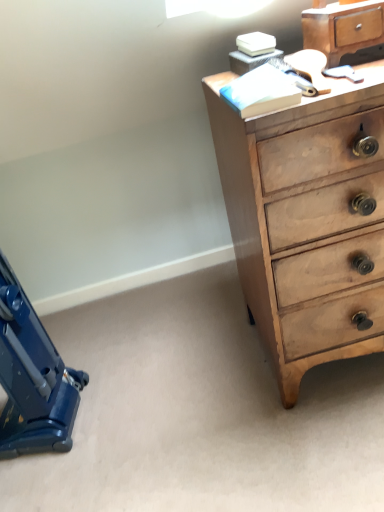
Image resolution: width=384 pixels, height=512 pixels. I want to click on wooden chest of drawers at upper right, so click(x=343, y=28).

What do you see at coordinates (343, 28) in the screenshot? I see `wooden chest of drawers at upper right` at bounding box center [343, 28].

The width and height of the screenshot is (384, 512). In order to click on blue plastic vacuum cleaner at lower left in this screenshot , I will do `click(32, 378)`.

Between light brown wood chest of drawers at upper right and blue plastic vacuum cleaner at lower left, which one has larger width?

Wider between the two is light brown wood chest of drawers at upper right.

From a real-world perspective, between light brown wood chest of drawers at upper right and blue plastic vacuum cleaner at lower left, who is vertically lower?

blue plastic vacuum cleaner at lower left is physically lower.

Considering the sizes of objects light brown wood chest of drawers at upper right and blue plastic vacuum cleaner at lower left in the image provided, who is bigger, light brown wood chest of drawers at upper right or blue plastic vacuum cleaner at lower left?

Bigger between the two is light brown wood chest of drawers at upper right.

In the scene shown: Is light brown wood chest of drawers at upper right further to the viewer compared to blue plastic vacuum cleaner at lower left?

No.

From a real-world perspective, is wooden chest of drawers at upper right positioned over light brown wood chest of drawers at upper right based on gravity?

Yes, from a real-world perspective, wooden chest of drawers at upper right is above light brown wood chest of drawers at upper right.

Is wooden chest of drawers at upper right positioned with its back to light brown wood chest of drawers at upper right?

wooden chest of drawers at upper right is not turned away from light brown wood chest of drawers at upper right.

Based on the photo, how many degrees apart are the facing directions of wooden chest of drawers at upper right and light brown wood chest of drawers at upper right?

The angle between the facing direction of wooden chest of drawers at upper right and the facing direction of light brown wood chest of drawers at upper right is 0.258 degrees.

Which of these two, wooden chest of drawers at upper right or light brown wood chest of drawers at upper right, is wider?

light brown wood chest of drawers at upper right is wider.

Does point (19, 289) appear closer or farther from the camera than point (349, 355)?

Point (19, 289).

From the image's perspective, between blue plastic vacuum cleaner at lower left and light brown wood chest of drawers at upper right, who is located below?

Result: blue plastic vacuum cleaner at lower left.

In terms of size, does blue plastic vacuum cleaner at lower left appear bigger or smaller than light brown wood chest of drawers at upper right?

blue plastic vacuum cleaner at lower left is smaller than light brown wood chest of drawers at upper right.

Consider the image. Considering their positions, is blue plastic vacuum cleaner at lower left located in front of or behind light brown wood chest of drawers at upper right?

Clearly, blue plastic vacuum cleaner at lower left is behind light brown wood chest of drawers at upper right.

Considering the sizes of objects wooden chest of drawers at upper right and blue plastic vacuum cleaner at lower left in the image provided, who is wider, wooden chest of drawers at upper right or blue plastic vacuum cleaner at lower left?

blue plastic vacuum cleaner at lower left is wider.

Considering the positions of objects wooden chest of drawers at upper right and blue plastic vacuum cleaner at lower left in the image provided, who is more to the left, wooden chest of drawers at upper right or blue plastic vacuum cleaner at lower left?

blue plastic vacuum cleaner at lower left is more to the left.

Is wooden chest of drawers at upper right outside of blue plastic vacuum cleaner at lower left?

wooden chest of drawers at upper right is positioned outside blue plastic vacuum cleaner at lower left.

Can you confirm if wooden chest of drawers at upper right is bigger than blue plastic vacuum cleaner at lower left?

Incorrect, wooden chest of drawers at upper right is not larger than blue plastic vacuum cleaner at lower left.

Can you confirm if blue plastic vacuum cleaner at lower left is smaller than wooden chest of drawers at upper right?

Incorrect, blue plastic vacuum cleaner at lower left is not smaller in size than wooden chest of drawers at upper right.

How many degrees apart are the facing directions of blue plastic vacuum cleaner at lower left and wooden chest of drawers at upper right?

The angular difference between blue plastic vacuum cleaner at lower left and wooden chest of drawers at upper right is 82.6 degrees.

Does blue plastic vacuum cleaner at lower left have a lesser height compared to wooden chest of drawers at upper right?

Incorrect, the height of blue plastic vacuum cleaner at lower left does not fall short of that of wooden chest of drawers at upper right.

Is blue plastic vacuum cleaner at lower left not close to wooden chest of drawers at upper right?

Yes.

Looking at their sizes, would you say light brown wood chest of drawers at upper right is wider or thinner than wooden chest of drawers at upper right?

Considering their sizes, light brown wood chest of drawers at upper right looks broader than wooden chest of drawers at upper right.

Is light brown wood chest of drawers at upper right looking in the opposite direction of wooden chest of drawers at upper right?

light brown wood chest of drawers at upper right is not turned away from wooden chest of drawers at upper right.

Looking at this image, from a real-world perspective, relative to wooden chest of drawers at upper right, is light brown wood chest of drawers at upper right vertically above or below?

Clearly, from a real-world perspective, light brown wood chest of drawers at upper right is below wooden chest of drawers at upper right.

In order to click on equipment below the light brown wood chest of drawers at upper right (from the image's perspective) in this screenshot , I will do `click(32, 378)`.

Where is `chest of drawers lying on the right of wooden chest of drawers at upper right`? The height and width of the screenshot is (512, 384). chest of drawers lying on the right of wooden chest of drawers at upper right is located at coordinates [x=306, y=221].

Looking at the image, which one is located further to wooden chest of drawers at upper right, blue plastic vacuum cleaner at lower left or light brown wood chest of drawers at upper right?

Among the two, blue plastic vacuum cleaner at lower left is located further to wooden chest of drawers at upper right.

Looking at this image, looking at the image, which one is located closer to light brown wood chest of drawers at upper right, wooden chest of drawers at upper right or blue plastic vacuum cleaner at lower left?

wooden chest of drawers at upper right is closer to light brown wood chest of drawers at upper right.

Considering their positions, is wooden chest of drawers at upper right positioned further to blue plastic vacuum cleaner at lower left than light brown wood chest of drawers at upper right?

wooden chest of drawers at upper right lies further to blue plastic vacuum cleaner at lower left than the other object.

Looking at the image, which one is located further to wooden chest of drawers at upper right, light brown wood chest of drawers at upper right or blue plastic vacuum cleaner at lower left?

The object further to wooden chest of drawers at upper right is blue plastic vacuum cleaner at lower left.

When comparing their distances from light brown wood chest of drawers at upper right, does blue plastic vacuum cleaner at lower left or wooden chest of drawers at upper right seem closer?

Among the two, wooden chest of drawers at upper right is located nearer to light brown wood chest of drawers at upper right.

Estimate the real-world distances between objects in this image. Which object is further from blue plastic vacuum cleaner at lower left, light brown wood chest of drawers at upper right or wooden chest of drawers at upper right?

Based on the image, wooden chest of drawers at upper right appears to be further to blue plastic vacuum cleaner at lower left.

The height and width of the screenshot is (512, 384). Find the location of `file cabinet between blue plastic vacuum cleaner at lower left and light brown wood chest of drawers at upper right in the horizontal direction`. file cabinet between blue plastic vacuum cleaner at lower left and light brown wood chest of drawers at upper right in the horizontal direction is located at coordinates (343, 28).